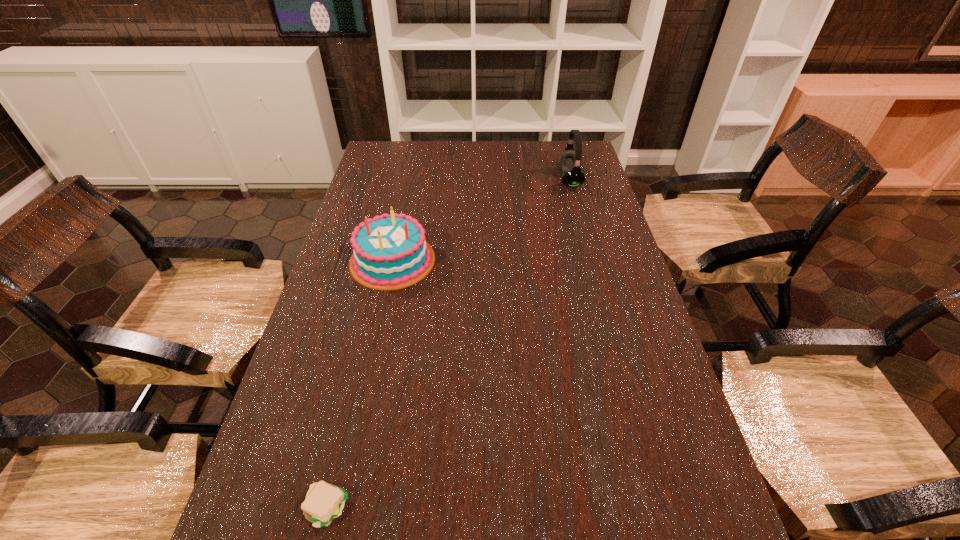
Identify which object is located as the nearest to the nearest object. Please provide its 2D coordinates. Your answer should be formatted as a tuple, i.e. [(x, y)], where the tuple contains the x and y coordinates of a point satisfying the conditions above.

[(389, 252)]

Locate an element on the screen. The width and height of the screenshot is (960, 540). free region that satisfies the following two spatial constraints: 1. on the back side of the patty; 2. on the right side of the second shortest object is located at coordinates (385, 260).

Locate an element on the screen. The width and height of the screenshot is (960, 540). vacant space that satisfies the following two spatial constraints: 1. on the back side of the patty; 2. on the right side of the second shortest object is located at coordinates (385, 260).

This screenshot has width=960, height=540. I want to click on free location that satisfies the following two spatial constraints: 1. on the ear cups of the rightmost object; 2. on the front side of the birthday cake, so click(x=591, y=260).

In order to click on vacant position in the image that satisfies the following two spatial constraints: 1. on the ear cups of the rightmost object; 2. on the front side of the second farthest object in this screenshot , I will do `click(591, 260)`.

The width and height of the screenshot is (960, 540). In order to click on vacant space that satisfies the following two spatial constraints: 1. on the back side of the second nearest object; 2. on the right side of the shortest object in this screenshot , I will do `click(385, 260)`.

The height and width of the screenshot is (540, 960). Find the location of `free point that satisfies the following two spatial constraints: 1. on the ear cups of the farthest object; 2. on the front side of the birthday cake`. free point that satisfies the following two spatial constraints: 1. on the ear cups of the farthest object; 2. on the front side of the birthday cake is located at coordinates (591, 260).